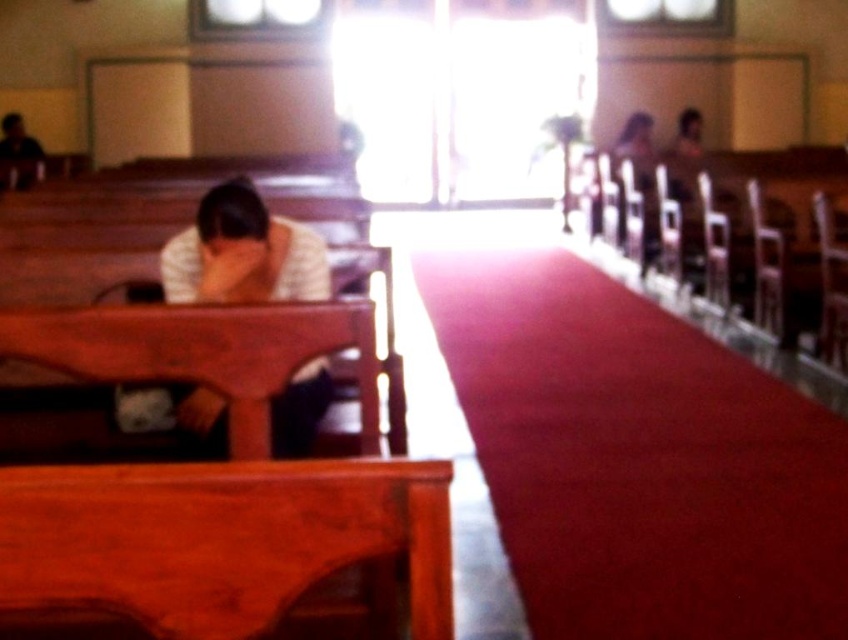
Question: Among these objects, which one is nearest to the camera?

Choices:
 (A) velvet red carpet at center
 (B) white matte shirt at left

Answer: (A)

Question: Which point is closer to the camera?

Choices:
 (A) (233, 260)
 (B) (550, 336)

Answer: (A)

Question: Is the position of velvet red carpet at center more distant than that of white matte shirt at left?

Choices:
 (A) no
 (B) yes

Answer: (A)

Question: Is velvet red carpet at center thinner than white matte shirt at left?

Choices:
 (A) yes
 (B) no

Answer: (B)

Question: Is velvet red carpet at center further to camera compared to white matte shirt at left?

Choices:
 (A) no
 (B) yes

Answer: (A)